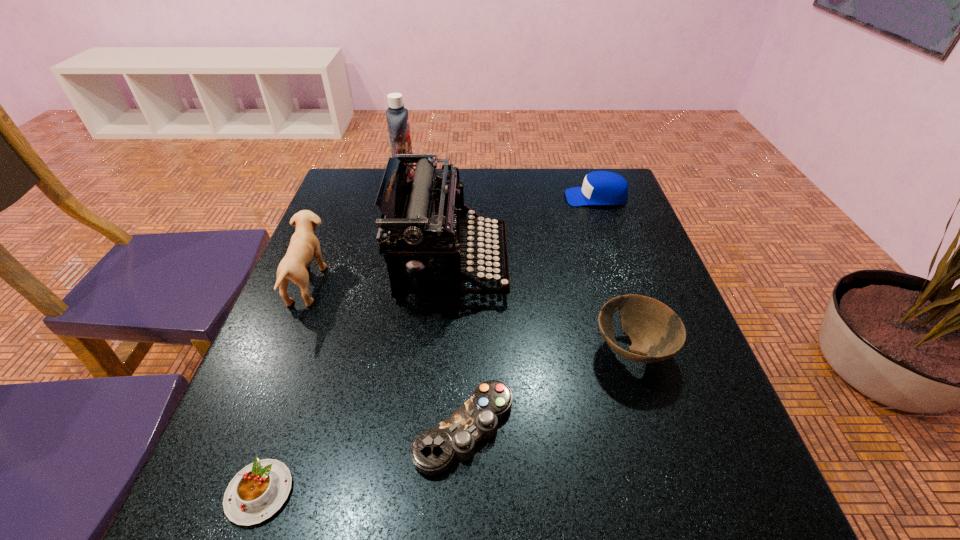
This screenshot has height=540, width=960. Identify the location of puppy that is at the left edge. (304, 245).

The height and width of the screenshot is (540, 960). I want to click on pudding that is at the left edge, so click(258, 491).

Find the location of a particular element. This screenshot has height=540, width=960. bowl that is positioned at the right edge is located at coordinates (655, 330).

This screenshot has height=540, width=960. I want to click on baseball cap located at the right edge, so click(x=599, y=187).

Find the location of a particular element. The width and height of the screenshot is (960, 540). object present at the near left corner is located at coordinates (258, 491).

The height and width of the screenshot is (540, 960). I want to click on object located at the far right corner, so click(599, 187).

In the image, there is a desktop. Where is `vacant area at the far edge`? The width and height of the screenshot is (960, 540). vacant area at the far edge is located at coordinates (469, 192).

Where is `vacant area at the left edge of the desktop`? The height and width of the screenshot is (540, 960). vacant area at the left edge of the desktop is located at coordinates (341, 352).

Locate an element on the screen. This screenshot has height=540, width=960. free space at the right edge of the desktop is located at coordinates (600, 279).

At what (x,y) coordinates should I click in order to perform the action: click on vacant space at the far left corner of the desktop. Please return your answer as a coordinate pair (x, y). This screenshot has width=960, height=540. Looking at the image, I should click on (370, 197).